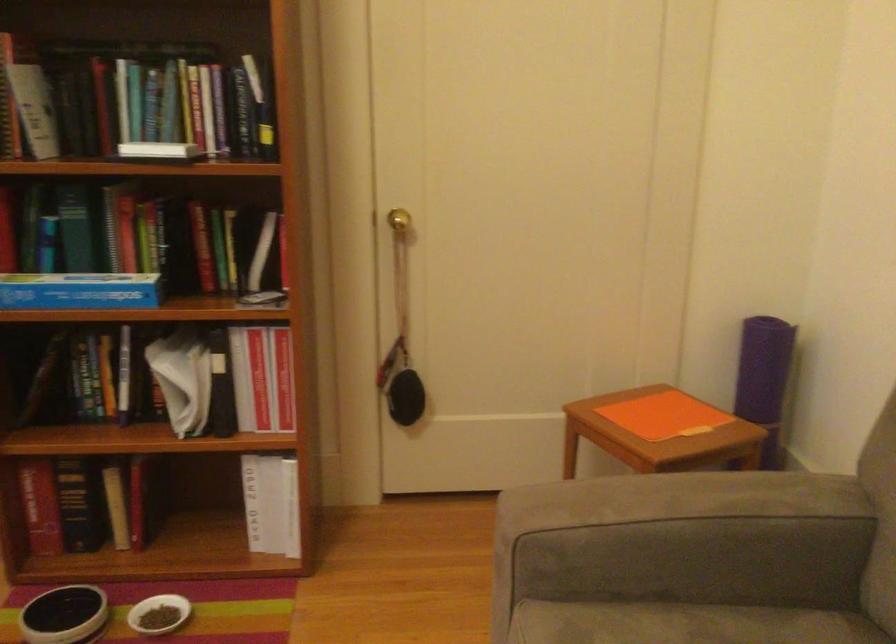
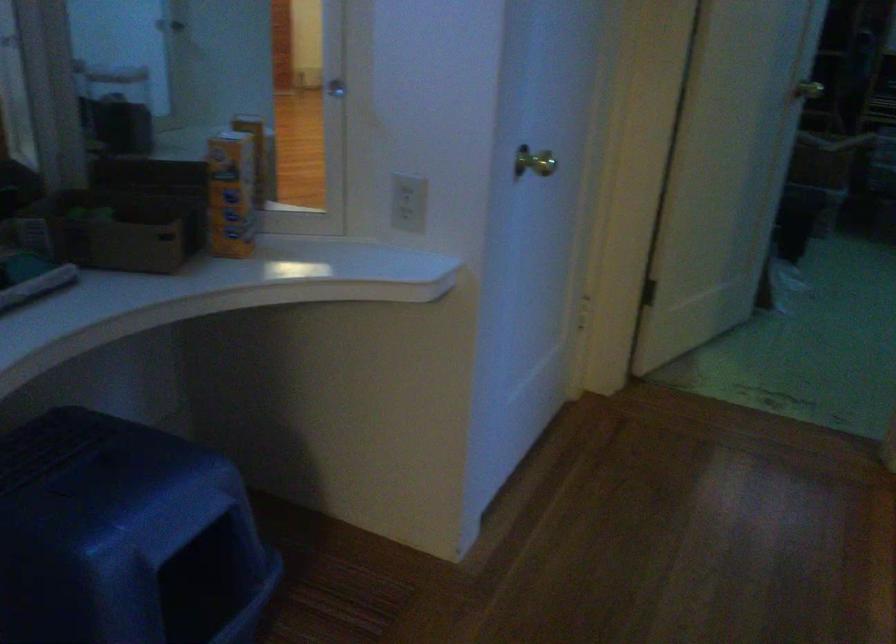
In a continuous first-person perspective shot, in which direction is the camera moving?

The cameraman walked toward left, forward.